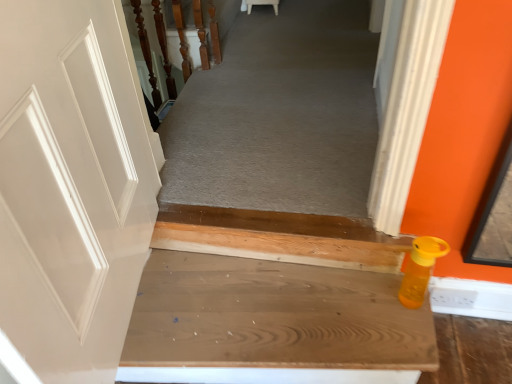
Question: Can you confirm if orange matte bottle at lower right is taller than wooden at upper left?

Choices:
 (A) yes
 (B) no

Answer: (B)

Question: Is the position of orange matte bottle at lower right more distant than that of wooden at upper left?

Choices:
 (A) yes
 (B) no

Answer: (B)

Question: Considering the relative positions of orange matte bottle at lower right and wooden at upper left in the image provided, is orange matte bottle at lower right to the right of wooden at upper left from the viewer's perspective?

Choices:
 (A) yes
 (B) no

Answer: (A)

Question: From the image's perspective, is orange matte bottle at lower right located beneath wooden at upper left?

Choices:
 (A) yes
 (B) no

Answer: (A)

Question: Considering the relative positions of orange matte bottle at lower right and wooden at upper left in the image provided, is orange matte bottle at lower right in front of wooden at upper left?

Choices:
 (A) no
 (B) yes

Answer: (B)

Question: Is point (276, 309) closer or farther from the camera than point (198, 26)?

Choices:
 (A) closer
 (B) farther

Answer: (A)

Question: Is wooden stairs at lower right taller or shorter than wooden at upper left?

Choices:
 (A) short
 (B) tall

Answer: (A)

Question: From the image's perspective, relative to wooden at upper left, is wooden stairs at lower right above or below?

Choices:
 (A) above
 (B) below

Answer: (B)

Question: Considering the positions of wooden stairs at lower right and wooden at upper left in the image, is wooden stairs at lower right bigger or smaller than wooden at upper left?

Choices:
 (A) small
 (B) big

Answer: (B)

Question: In terms of height, does wooden stairs at lower right look taller or shorter compared to orange matte bottle at lower right?

Choices:
 (A) short
 (B) tall

Answer: (A)

Question: Is wooden stairs at lower right situated inside orange matte bottle at lower right or outside?

Choices:
 (A) inside
 (B) outside

Answer: (B)

Question: From a real-world perspective, relative to orange matte bottle at lower right, is wooden stairs at lower right vertically above or below?

Choices:
 (A) below
 (B) above

Answer: (A)

Question: Considering the positions of wooden stairs at lower right and orange matte bottle at lower right in the image, is wooden stairs at lower right bigger or smaller than orange matte bottle at lower right?

Choices:
 (A) big
 (B) small

Answer: (A)

Question: Considering the positions of point (406, 299) and point (296, 230), is point (406, 299) closer or farther from the camera than point (296, 230)?

Choices:
 (A) closer
 (B) farther

Answer: (A)

Question: From the image's perspective, is orange matte bottle at lower right located above or below wooden stairs at lower right?

Choices:
 (A) above
 (B) below

Answer: (A)